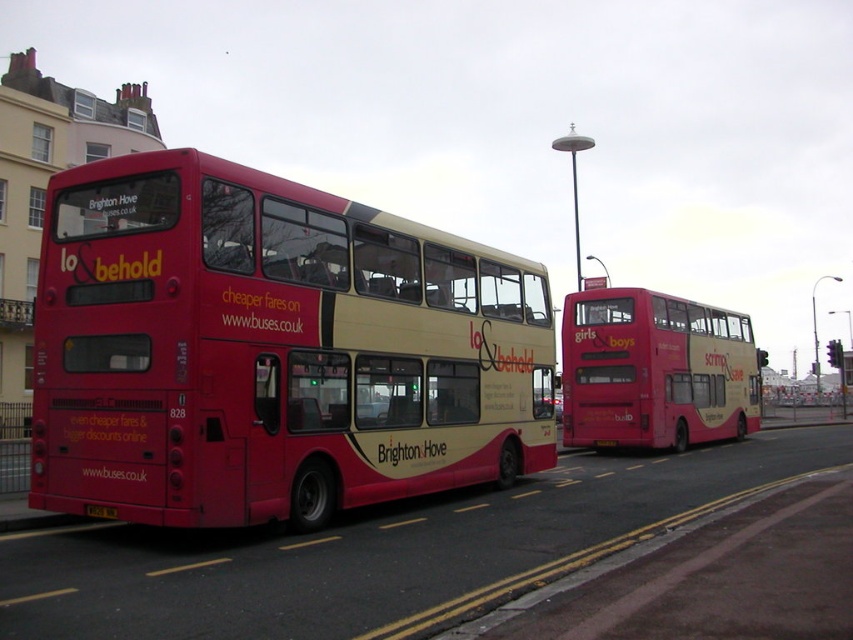
Looking at this image, you are a delivery person trying to park your motorcycle between the matte pink bus at center and the black plastic license plate at rear. The motorcycle requires 1.2 meters of space to fit. Can you park your motorcycle there?

The matte pink bus at center is wider than the black plastic license plate at rear, but the description does not provide specific measurements of the space between them. Therefore, it is unclear if there is enough space for the motorcycle to fit.

You are a photographer trying to capture the entire matte pink bus at center and the black plastic license plate at rear in one frame. Considering their sizes, which object will appear bigger in your photo?

The matte pink bus at center will appear bigger in the photo because it has a larger size compared to the black plastic license plate at rear.

You are a passenger standing at point (654, 371) in the scene. You want to board the nearest bus. Which bus should you approach?

The nearest bus to point (654, 371) is the matte pink bus at center, so you should approach the matte pink bus at center.